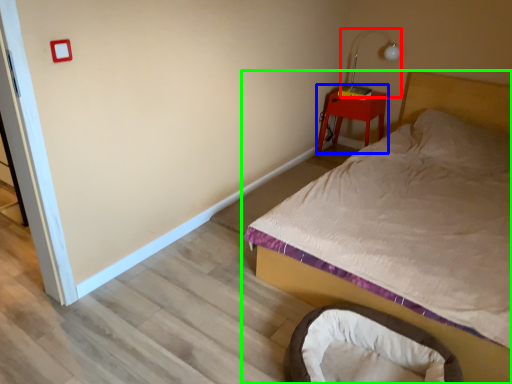
Question: Which object is positioned closest to table lamp (highlighted by a red box)? Select from nightstand (highlighted by a blue box) and bed (highlighted by a green box).

Choices:
 (A) nightstand
 (B) bed

Answer: (A)